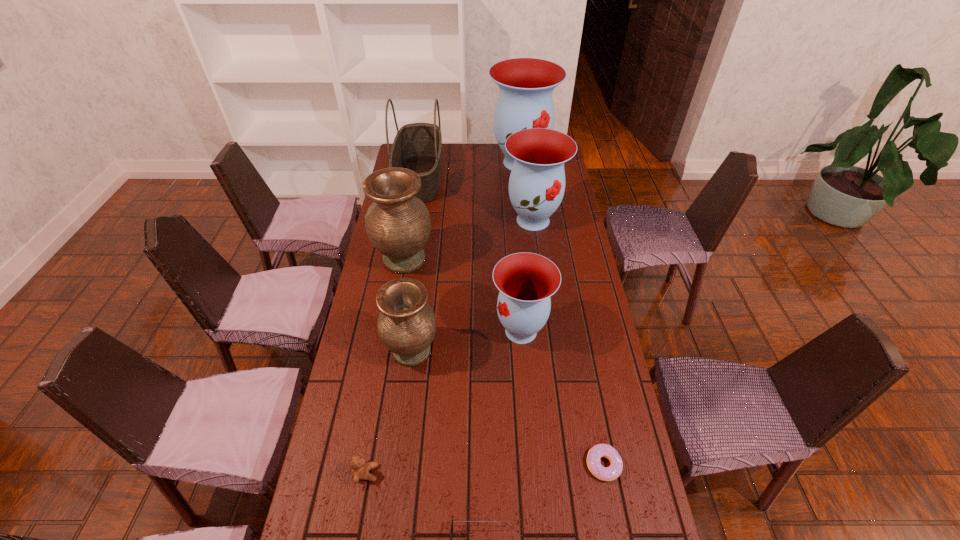
Where is `basket located in the far edge section of the desktop`? The width and height of the screenshot is (960, 540). basket located in the far edge section of the desktop is located at coordinates (418, 146).

Identify the location of basket located at the left edge. (418, 146).

Locate an element on the screen. Image resolution: width=960 pixels, height=540 pixels. teddy bear that is at the left edge is located at coordinates (360, 468).

Where is `doughnut that is at the right edge`? This screenshot has width=960, height=540. doughnut that is at the right edge is located at coordinates (610, 473).

I want to click on object present at the far left corner, so click(x=418, y=146).

The height and width of the screenshot is (540, 960). Find the location of `object at the far right corner`. object at the far right corner is located at coordinates (526, 85).

Where is `vacant region at the far edge of the desktop`? The width and height of the screenshot is (960, 540). vacant region at the far edge of the desktop is located at coordinates (444, 150).

Where is `vacant region at the left edge of the desktop`? The height and width of the screenshot is (540, 960). vacant region at the left edge of the desktop is located at coordinates (365, 299).

Locate an element on the screen. The height and width of the screenshot is (540, 960). free space at the right edge is located at coordinates (567, 334).

The width and height of the screenshot is (960, 540). What are the coordinates of `free spot between the second farthest red vase and the smaller green vase` in the screenshot? It's located at (472, 286).